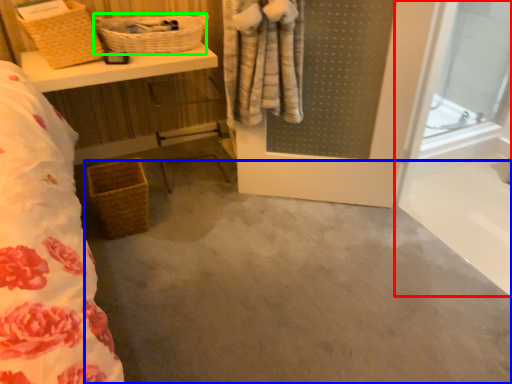
Question: Considering the real-world distances, which object is farthest from glass door (highlighted by a red box)? concrete (highlighted by a blue box) or basket (highlighted by a green box)?

Choices:
 (A) concrete
 (B) basket

Answer: (B)